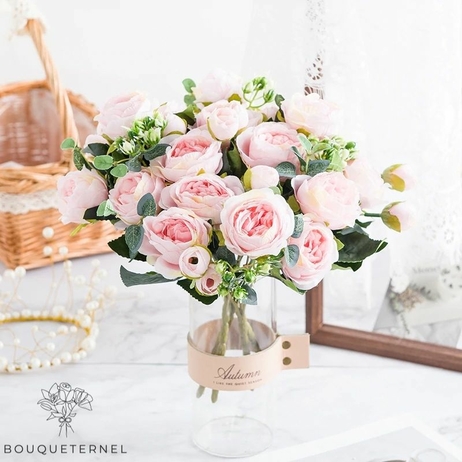
Find the location of a particular element. white table is located at coordinates (67, 8), (20, 388), (23, 421), (119, 428), (136, 386), (168, 435), (327, 382), (436, 382), (442, 419), (327, 420).